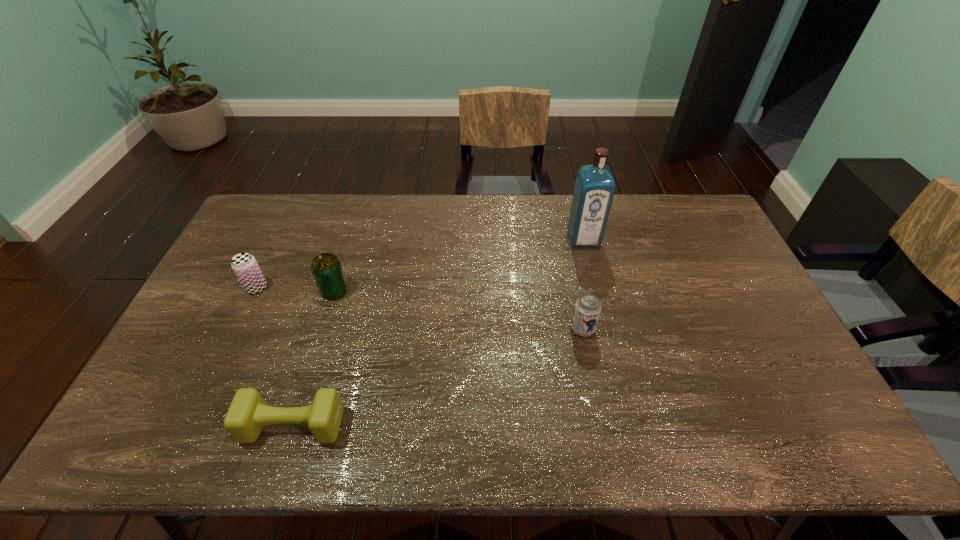
This screenshot has height=540, width=960. Identify the location of the tallest object. (595, 186).

Locate an element on the screen. The width and height of the screenshot is (960, 540). liquor is located at coordinates (595, 186).

This screenshot has height=540, width=960. In order to click on the second beer can from left to right in this screenshot , I will do tap(326, 268).

You are a GUI agent. You are given a task and a screenshot of the screen. Output one action in this format:
    pyautogui.click(x=<x>, y=<y>)
    Task: Click on the leftmost object
    The width and height of the screenshot is (960, 540).
    Given the screenshot: What is the action you would take?
    pyautogui.click(x=244, y=265)

The image size is (960, 540). In order to click on the second nearest object in this screenshot , I will do `click(587, 310)`.

Identify the location of the nearest beer can. This screenshot has height=540, width=960. (587, 310).

Identify the location of the nearest object. (248, 413).

The height and width of the screenshot is (540, 960). Identify the location of the shortest object. (248, 413).

This screenshot has width=960, height=540. What are the coordinates of `vacant space located on the flat label side of the farthest object` in the screenshot? It's located at (603, 318).

Image resolution: width=960 pixels, height=540 pixels. What are the coordinates of `vacant space located 0.380m on the front of the second beer can from right to left` in the screenshot? It's located at (295, 420).